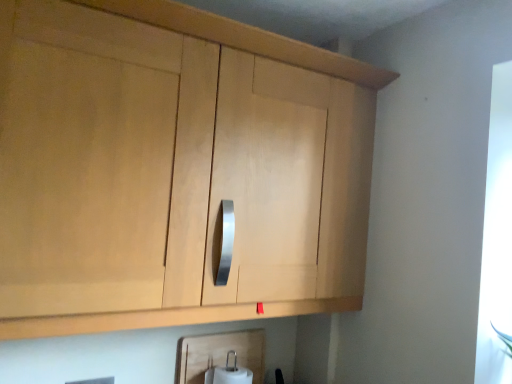
This screenshot has width=512, height=384. What do you see at coordinates (229, 373) in the screenshot?
I see `white matte toilet paper at lower center` at bounding box center [229, 373].

The width and height of the screenshot is (512, 384). In order to click on white matte toilet paper at lower center in this screenshot , I will do pyautogui.click(x=229, y=373).

Describe the element at coordinates (174, 168) in the screenshot. I see `light wood cabinet at upper center` at that location.

What is the approximate height of light wood cabinet at upper center?

light wood cabinet at upper center is 32.48 inches tall.

Locate an element on the screen. This screenshot has width=512, height=384. light wood cabinet at upper center is located at coordinates (174, 168).

This screenshot has height=384, width=512. I want to click on white matte toilet paper at lower center, so click(x=229, y=373).

Can you confirm if light wood cabinet at upper center is positioned to the right of white matte toilet paper at lower center?

Incorrect, light wood cabinet at upper center is not on the right side of white matte toilet paper at lower center.

In the image, is light wood cabinet at upper center positioned in front of or behind white matte toilet paper at lower center?

In the image, light wood cabinet at upper center appears in front of white matte toilet paper at lower center.

Is point (377, 75) positioned behind point (233, 369)?

No.

From the image's perspective, between light wood cabinet at upper center and white matte toilet paper at lower center, which one is located above?

light wood cabinet at upper center.

From a real-world perspective, relative to white matte toilet paper at lower center, is light wood cabinet at upper center vertically above or below?

Clearly, from a real-world perspective, light wood cabinet at upper center is above white matte toilet paper at lower center.

Which object is wider, light wood cabinet at upper center or white matte toilet paper at lower center?

Wider between the two is light wood cabinet at upper center.

Which of these two, light wood cabinet at upper center or white matte toilet paper at lower center, stands taller?

With more height is light wood cabinet at upper center.

Is light wood cabinet at upper center bigger than white matte toilet paper at lower center?

Indeed, light wood cabinet at upper center has a larger size compared to white matte toilet paper at lower center.

Is light wood cabinet at upper center not inside white matte toilet paper at lower center?

That's correct, light wood cabinet at upper center is outside of white matte toilet paper at lower center.

Is light wood cabinet at upper center far from white matte toilet paper at lower center?

light wood cabinet at upper center is actually quite close to white matte toilet paper at lower center.

Is white matte toilet paper at lower center at the back of light wood cabinet at upper center?

That's not correct — light wood cabinet at upper center is not looking away from white matte toilet paper at lower center.

Can you tell me how much light wood cabinet at upper center and white matte toilet paper at lower center differ in facing direction?

The facing directions of light wood cabinet at upper center and white matte toilet paper at lower center are 0.176 degrees apart.

How distant is light wood cabinet at upper center from white matte toilet paper at lower center?

The distance of light wood cabinet at upper center from white matte toilet paper at lower center is 76.93 centimeters.

I want to click on cabinetry on the left of the white matte toilet paper at lower center, so click(x=174, y=168).

Which object is positioned more to the left, white matte toilet paper at lower center or light wood cabinet at upper center?

Positioned to the left is light wood cabinet at upper center.

Is white matte toilet paper at lower center in front of or behind light wood cabinet at upper center in the image?

Clearly, white matte toilet paper at lower center is behind light wood cabinet at upper center.

Does point (213, 381) appear closer or farther from the camera than point (289, 245)?

Point (213, 381).

From the image's perspective, which one is positioned higher, white matte toilet paper at lower center or light wood cabinet at upper center?

light wood cabinet at upper center is shown above in the image.

From a real-world perspective, between white matte toilet paper at lower center and light wood cabinet at upper center, who is vertically higher?

From a 3D spatial view, light wood cabinet at upper center is above.

Based on the photo, between white matte toilet paper at lower center and light wood cabinet at upper center, which one has smaller width?

Thinner between the two is white matte toilet paper at lower center.

Consider the image. Which of these two, white matte toilet paper at lower center or light wood cabinet at upper center, stands shorter?

white matte toilet paper at lower center is shorter.

Between white matte toilet paper at lower center and light wood cabinet at upper center, which one has smaller size?

white matte toilet paper at lower center is smaller.

Is white matte toilet paper at lower center inside or outside of light wood cabinet at upper center?

white matte toilet paper at lower center is spatially situated outside light wood cabinet at upper center.

Can you see white matte toilet paper at lower center touching light wood cabinet at upper center?

No.

Is white matte toilet paper at lower center oriented towards light wood cabinet at upper center?

No.

What's the angular difference between white matte toilet paper at lower center and light wood cabinet at upper center's facing directions?

The angle between the facing direction of white matte toilet paper at lower center and the facing direction of light wood cabinet at upper center is 0.176 degrees.

How far apart are white matte toilet paper at lower center and light wood cabinet at upper center?

white matte toilet paper at lower center and light wood cabinet at upper center are 30.29 inches apart from each other.

The image size is (512, 384). What are the coordinates of `toilet paper that appears behind the light wood cabinet at upper center` in the screenshot? It's located at (229, 373).

Image resolution: width=512 pixels, height=384 pixels. In order to click on cabinetry that appears on the left of white matte toilet paper at lower center in this screenshot , I will do (x=174, y=168).

Where is `toilet paper on the right of light wood cabinet at upper center`? Image resolution: width=512 pixels, height=384 pixels. toilet paper on the right of light wood cabinet at upper center is located at coordinates (229, 373).